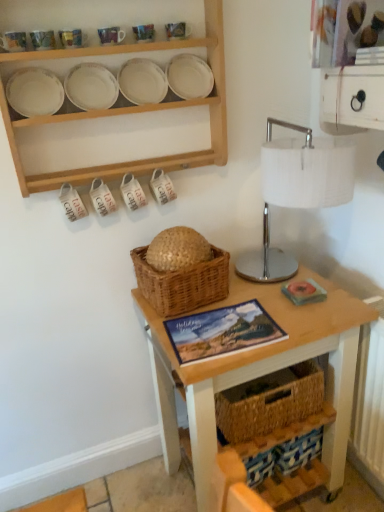
Where is `vacant area that lies to the right of woven straw basket at center`? vacant area that lies to the right of woven straw basket at center is located at coordinates (256, 297).